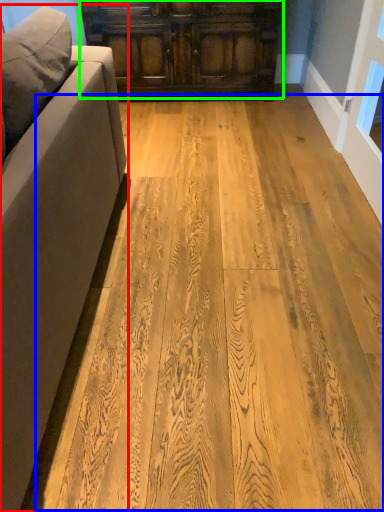
Question: Estimate the real-world distances between objects in this image. Which object is farther from studio couch (highlighted by a red box), plywood (highlighted by a blue box) or cabinetry (highlighted by a green box)?

Choices:
 (A) plywood
 (B) cabinetry

Answer: (B)